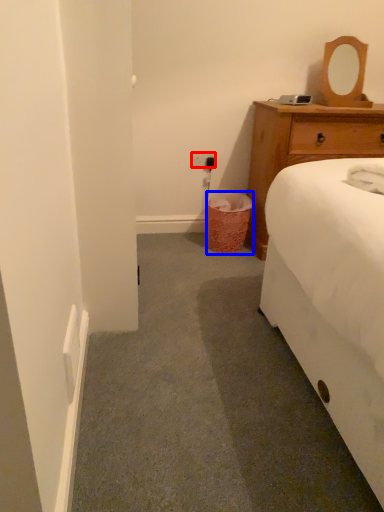
Question: Which point is further to the camera, power outlet (highlighted by a red box) or trash bin/can (highlighted by a blue box)?

Choices:
 (A) power outlet
 (B) trash bin/can

Answer: (A)